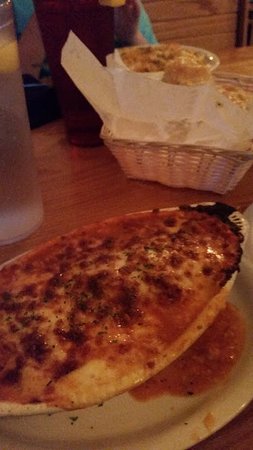
This screenshot has width=253, height=450. Identify the location of cup. (4, 134), (95, 31).